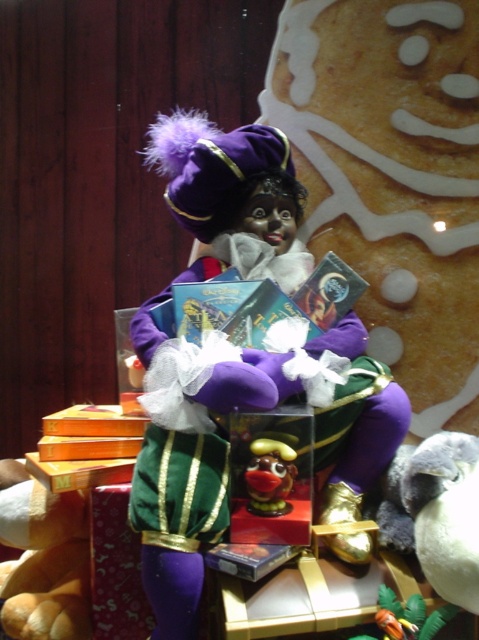
Question: Estimate the real-world distances between objects in this image. Which object is closer to the rubber duck at center?

Choices:
 (A) white plush teddy bear at lower left
 (B) purple velvet doll at center

Answer: (B)

Question: Can you confirm if purple velvet doll at center is bigger than white plush teddy bear at lower left?

Choices:
 (A) yes
 (B) no

Answer: (A)

Question: Among these points, which one is nearest to the camera?

Choices:
 (A) (171, 376)
 (B) (259, 508)
 (C) (61, 589)

Answer: (B)

Question: Is purple velvet doll at center below white plush teddy bear at lower left?

Choices:
 (A) yes
 (B) no

Answer: (B)

Question: Considering the relative positions of purple velvet doll at center and rubber duck at center in the image provided, where is purple velvet doll at center located with respect to rubber duck at center?

Choices:
 (A) right
 (B) left

Answer: (A)

Question: Which point appears closest to the camera in this image?

Choices:
 (A) (192, 550)
 (B) (19, 628)

Answer: (A)